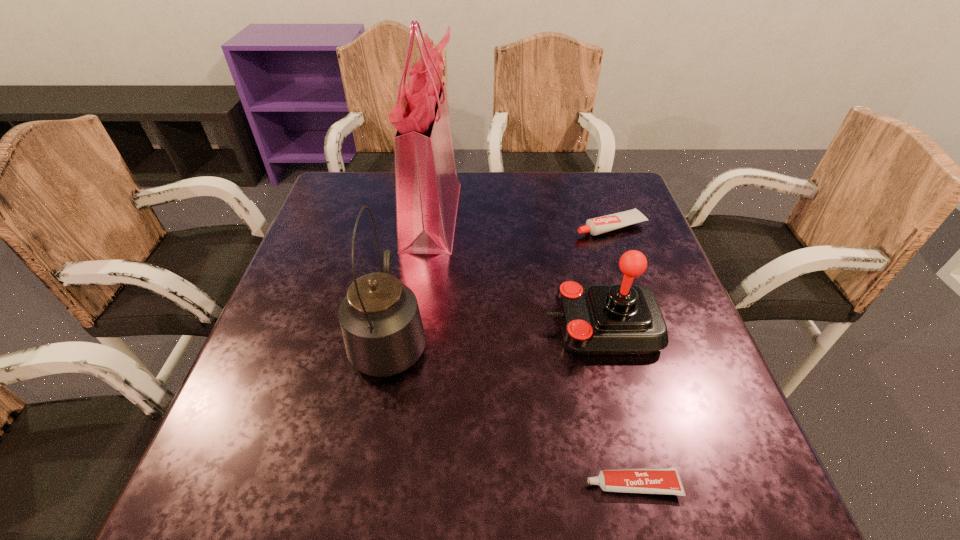
Locate an element on the screen. vacant space located spout on the kettle is located at coordinates (405, 255).

The image size is (960, 540). Find the location of `vacant space located 0.200m on the base of the third tallest object`. vacant space located 0.200m on the base of the third tallest object is located at coordinates 449,326.

Where is `free space located on the base of the third tallest object`? free space located on the base of the third tallest object is located at coordinates tap(512, 326).

Image resolution: width=960 pixels, height=540 pixels. What are the coordinates of `vacant space located on the base of the third tallest object` in the screenshot? It's located at (483, 326).

In order to click on vacant region located 0.090m on the front of the fourth tallest object in this screenshot , I will do `click(623, 263)`.

Locate an element on the screen. This screenshot has height=540, width=960. free space located 0.110m at the nozzle of the shortest object is located at coordinates [516, 484].

Find the location of a particular element. vacant space located 0.310m at the nozzle of the shortest object is located at coordinates (390, 484).

Where is `blank space located at the nozzle of the shortest object`? blank space located at the nozzle of the shortest object is located at coordinates (485, 484).

You are a GUI agent. You are given a task and a screenshot of the screen. Output one action in this format:
    pyautogui.click(x=<x>, y=<y>)
    Task: Click on the shopping bag that is at the far edge
    Image resolution: width=960 pixels, height=540 pixels.
    Given the screenshot: What is the action you would take?
    pyautogui.click(x=427, y=188)

At what (x,y) coordinates should I click in order to perform the action: click on toothpaste present at the far edge. Please return your answer as a coordinate pair (x, y). Looking at the image, I should click on (595, 226).